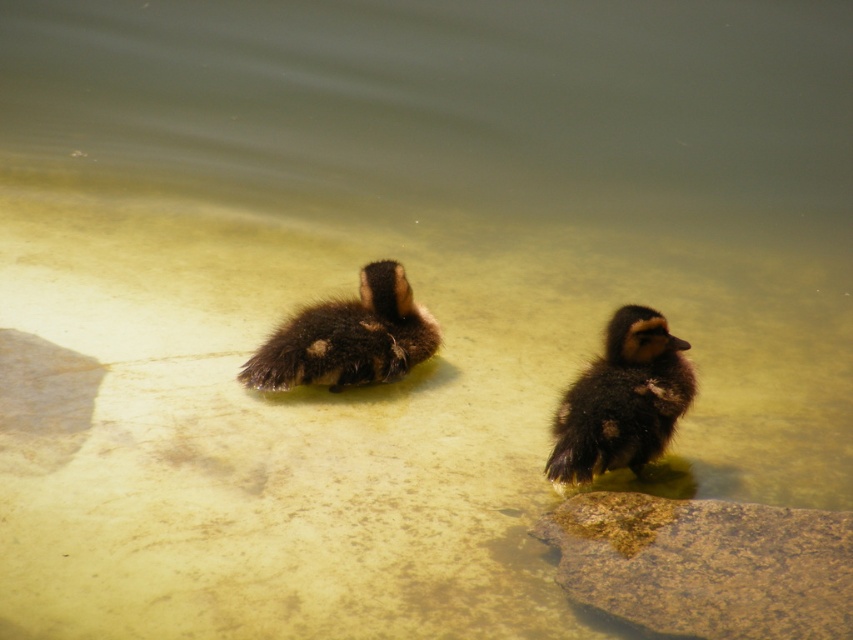
You are a photographer aiming to capture a closeup of the dark brown fluffy duckling at center. However, you notice the brown textured rock at lower right might obstruct your shot. Based on their positions, will the rock block the duckling in your view?

The brown textured rock at lower right is located below the dark brown fluffy duckling at center, so it might block part of the duckling depending on the angle, but since it is positioned lower, adjusting the camera angle slightly upward could avoid obstruction.

You are a wildlife photographer trying to capture both the dark brown fluffy duckling at center and the brown fuzzy duckling at center in a single frame. Based on their sizes, which duckling would require you to zoom in more to ensure it fills the frame adequately?

The dark brown fluffy duckling at center occupies less space than the brown fuzzy duckling at center, so you would need to zoom in more on the dark brown fluffy duckling at center to fill the frame adequately.

You are a wildlife photographer trying to capture a closeup of both the dark brown fluffy duckling at center and the brown fuzzy duckling at center. Since you want to focus on one duckling at a time, which duckling should you adjust your camera focus to first if you want to start with the one that is closer to the camera?

Result: The dark brown fluffy duckling at center is positioned under the brown fuzzy duckling at center, so it is closer to the camera. Therefore, you should adjust your camera focus to the dark brown fluffy duckling at center first.